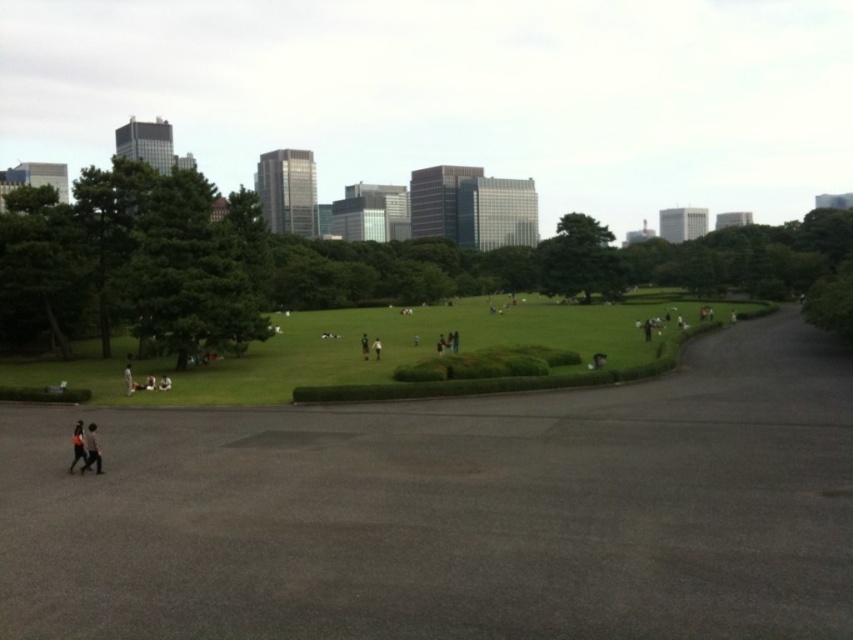
Does white fabric person at lower left have a greater height compared to dark brown leather jacket at center?

No.

Between point (125, 387) and point (373, 349), which one is positioned behind?

Point (373, 349)

Find the location of `white fabric person at lower left`. white fabric person at lower left is located at coordinates (128, 380).

Locate an element on the screen. dark asphalt path at center is located at coordinates (454, 512).

Can you confirm if dark asphalt path at center is positioned below dark gray jacket at lower left?

Yes.

Identify the location of dark asphalt path at center. (454, 512).

Find the location of a particular element. dark asphalt path at center is located at coordinates (454, 512).

Who is higher up, dark asphalt path at center or dark brown leather jacket at center?

dark brown leather jacket at center is higher up.

Which is in front, point (41, 589) or point (380, 349)?

Point (41, 589)

Where is `dark asphalt path at center`? dark asphalt path at center is located at coordinates (454, 512).